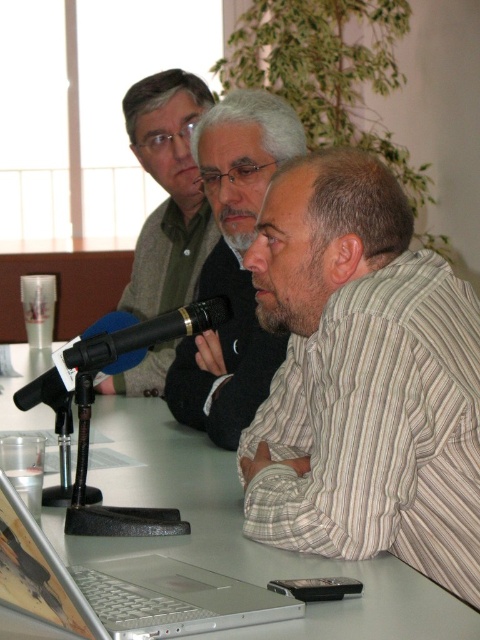
Question: Which object is the farthest from the silver metallic table at center?

Choices:
 (A) black matte microphone at center
 (B) matte black microphone at left
 (C) matte black jacket at center

Answer: (B)

Question: Is matte black microphone at left below black matte microphone at center?

Choices:
 (A) no
 (B) yes

Answer: (A)

Question: From the image, what is the correct spatial relationship of matte black jacket at center in relation to silver metallic laptop at lower left?

Choices:
 (A) below
 (B) above

Answer: (B)

Question: Which point is closer to the camera taking this photo?

Choices:
 (A) (255, 552)
 (B) (203, 269)
 (C) (432, 426)

Answer: (A)

Question: Is striped cotton shirt at center further to the viewer compared to matte black microphone at left?

Choices:
 (A) yes
 (B) no

Answer: (B)

Question: Which of the following is the farthest from the observer?

Choices:
 (A) silver metallic laptop at lower left
 (B) matte black jacket at center
 (C) matte black microphone at left
 (D) black matte microphone at center

Answer: (C)